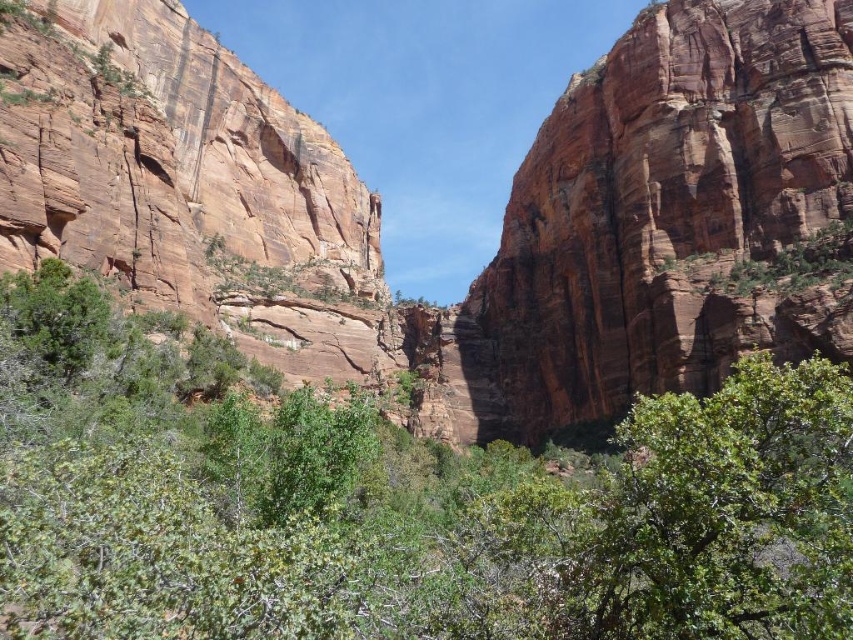
Question: Considering the relative positions of green leafy shrubs at center and rustic sandstone cliff at center in the image provided, where is green leafy shrubs at center located with respect to rustic sandstone cliff at center?

Choices:
 (A) below
 (B) above

Answer: (A)

Question: Can you confirm if green leafy shrubs at center is bigger than rustic sandstone cliff at center?

Choices:
 (A) no
 (B) yes

Answer: (A)

Question: Among these points, which one is nearest to the camera?

Choices:
 (A) (706, 99)
 (B) (492, 499)

Answer: (B)

Question: In this image, where is green leafy shrubs at center located relative to rustic sandstone cliff at center?

Choices:
 (A) above
 (B) below

Answer: (B)